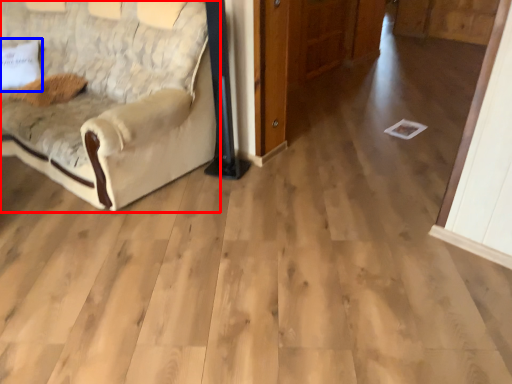
Question: Which object is closer to the camera taking this photo, studio couch (highlighted by a red box) or pillow (highlighted by a blue box)?

Choices:
 (A) studio couch
 (B) pillow

Answer: (A)